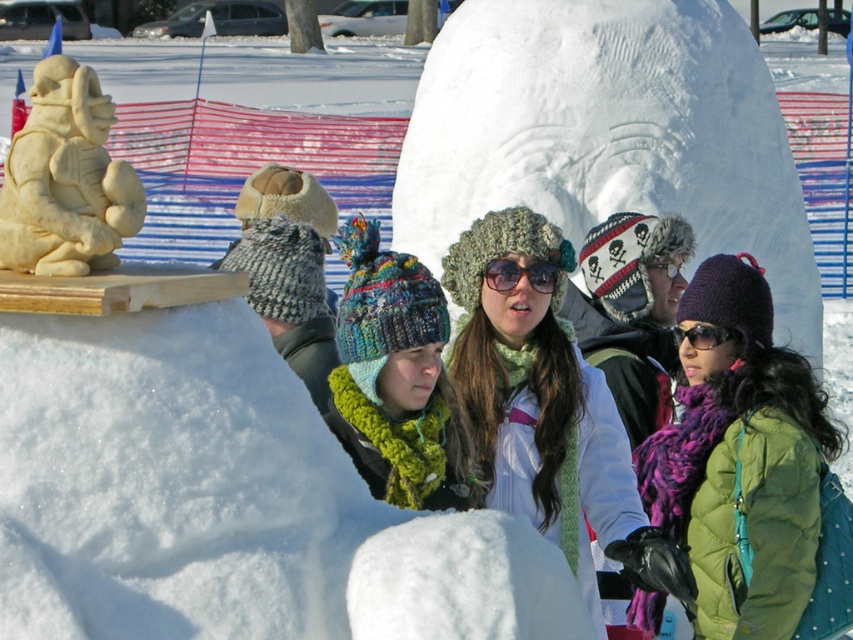
Does white knit hat at center appear under light beige snowman at upper left?

Yes.

Between white knit hat at center and light beige snowman at upper left, which one is positioned lower?

Positioned lower is white knit hat at center.

Which is in front, point (474, 308) or point (100, 244)?

Point (100, 244) is more forward.

The height and width of the screenshot is (640, 853). Find the location of `white knit hat at center`. white knit hat at center is located at coordinates (540, 401).

Who is lower down, purple fuzzy scarf at center or black plastic goggles at center?

Positioned lower is purple fuzzy scarf at center.

Does purple fuzzy scarf at center have a larger size compared to black plastic goggles at center?

Yes, purple fuzzy scarf at center is bigger than black plastic goggles at center.

In order to click on purple fuzzy scarf at center in this screenshot , I will do `click(750, 472)`.

Image resolution: width=853 pixels, height=640 pixels. In order to click on purple fuzzy scarf at center in this screenshot , I will do `click(750, 472)`.

Does purple fuzzy scarf at center come in front of light beige snowman at upper left?

No.

In the scene shown: Does purple fuzzy scarf at center have a lesser width compared to light beige snowman at upper left?

Incorrect, purple fuzzy scarf at center's width is not less than light beige snowman at upper left's.

Which is behind, point (769, 310) or point (70, 160)?

Point (769, 310)

Locate an element on the screen. purple fuzzy scarf at center is located at coordinates (750, 472).